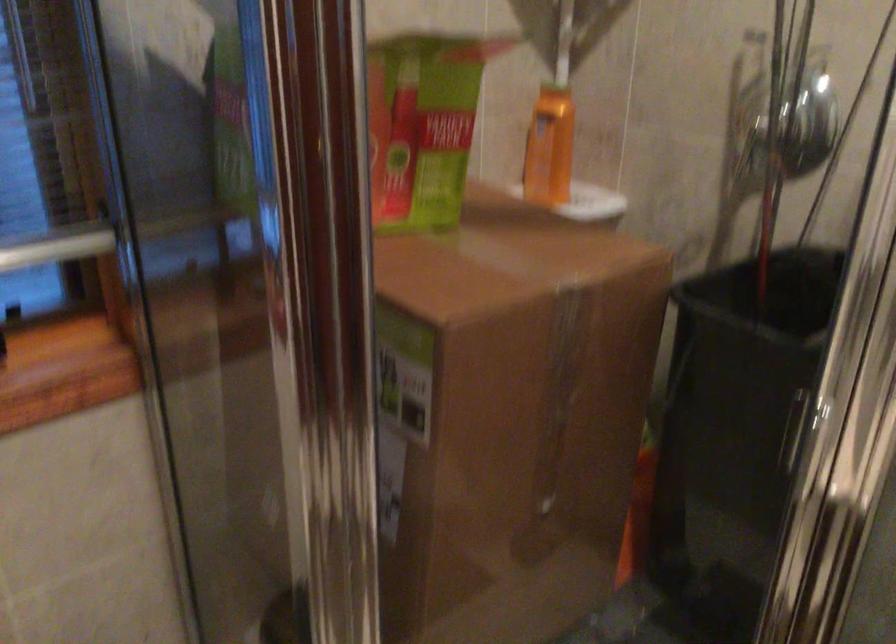
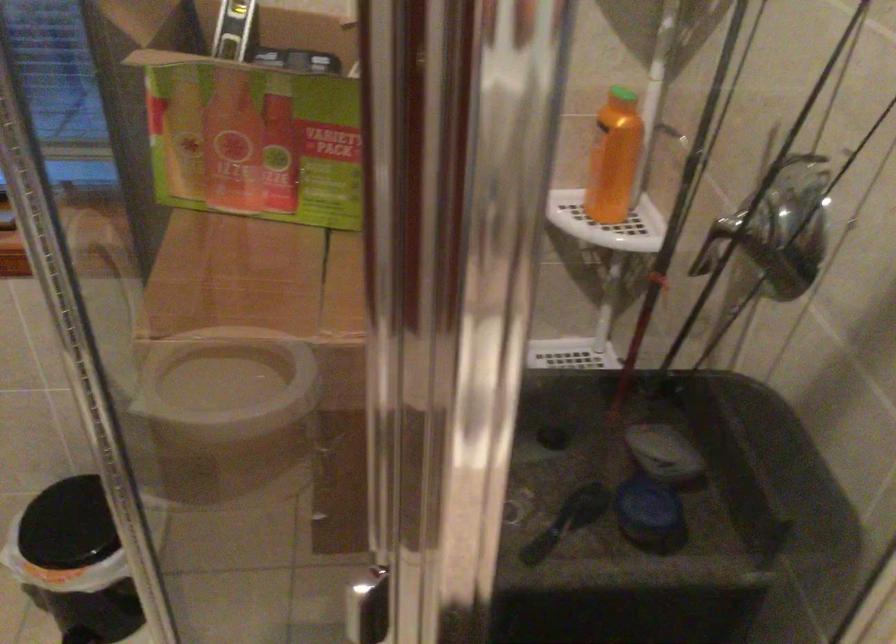
Find the pixel in the second image that matches (x=769, y=109) in the first image.

(676, 212)